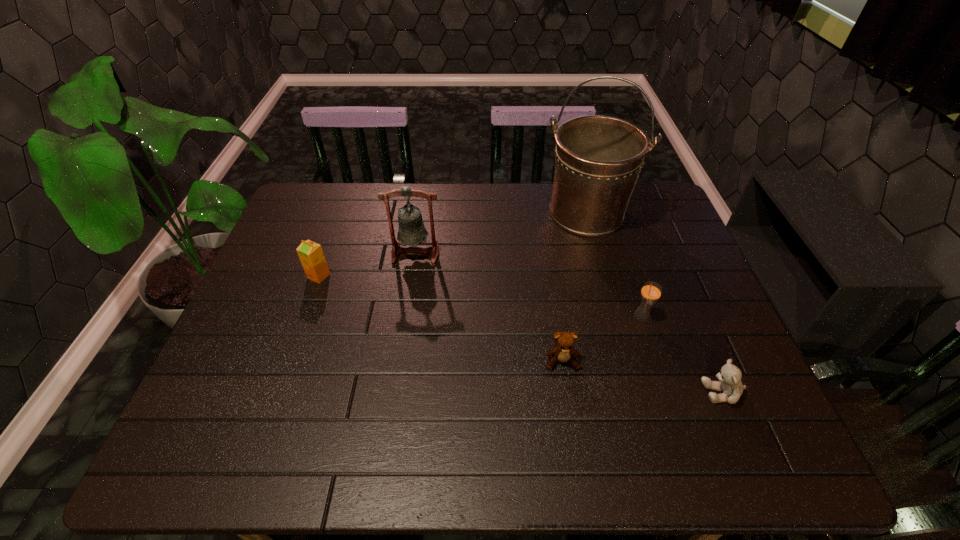
This screenshot has width=960, height=540. I want to click on object positioned at the left edge, so click(311, 255).

Locate an element on the screen. bucket that is positioned at the right edge is located at coordinates (598, 159).

You are a GUI agent. You are given a task and a screenshot of the screen. Output one action in this format:
    pyautogui.click(x=<x>, y=<y>)
    Task: Click on the teddy bear that is at the right edge
    The image size is (960, 540).
    Given the screenshot: What is the action you would take?
    pyautogui.click(x=729, y=377)

Identify the location of object at the far right corner. The height and width of the screenshot is (540, 960). (598, 159).

The image size is (960, 540). In the image, there is a desktop. What are the coordinates of `vacant area at the far edge` in the screenshot? It's located at (443, 183).

You are a GUI agent. You are given a task and a screenshot of the screen. Output one action in this format:
    pyautogui.click(x=<x>, y=<y>)
    Task: Click on the free region at the near edge
    This screenshot has height=540, width=960.
    Given the screenshot: What is the action you would take?
    pyautogui.click(x=342, y=463)

At what (x,y) coordinates should I click in order to perform the action: click on vacant region at the left edge of the desktop. Please return your answer as a coordinate pair (x, y). Looking at the image, I should click on (291, 336).

Identify the location of vacant space at the right edge of the desktop. (654, 230).

You are a GUI agent. You are given a task and a screenshot of the screen. Output one action in this format:
    pyautogui.click(x=<x>, y=<y>)
    Task: Click on the free space at the far left corner of the desktop
    
    Given the screenshot: What is the action you would take?
    pyautogui.click(x=305, y=201)

In order to click on free point at the near left corner in this screenshot , I will do `click(239, 451)`.